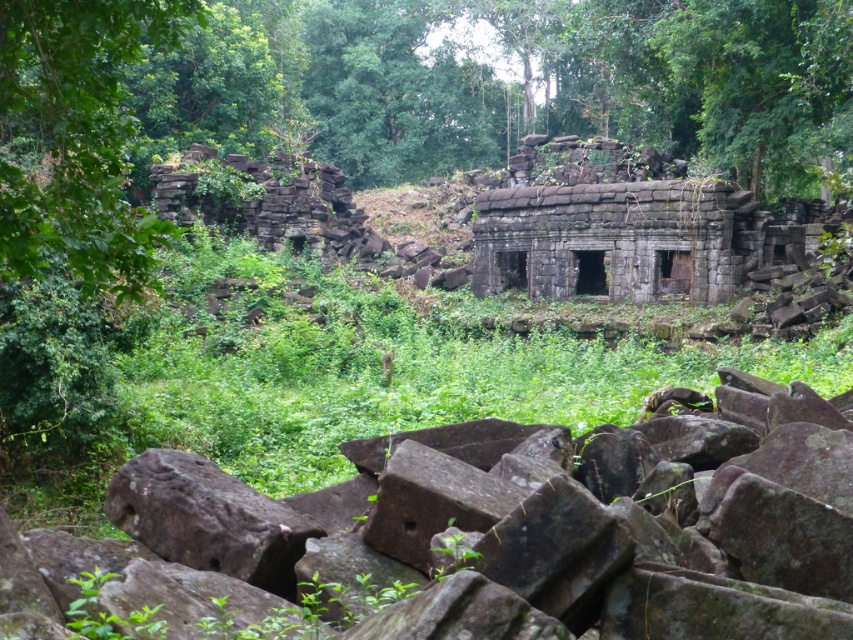
Does gray rough stone at center appear on the left side of green leafy tree at left?

In fact, gray rough stone at center is to the right of green leafy tree at left.

Does gray rough stone at center have a greater height compared to green leafy tree at left?

No, gray rough stone at center is not taller than green leafy tree at left.

Image resolution: width=853 pixels, height=640 pixels. Describe the element at coordinates (547, 524) in the screenshot. I see `gray rough stone at center` at that location.

Locate an element on the screen. This screenshot has width=853, height=640. gray rough stone at center is located at coordinates (547, 524).